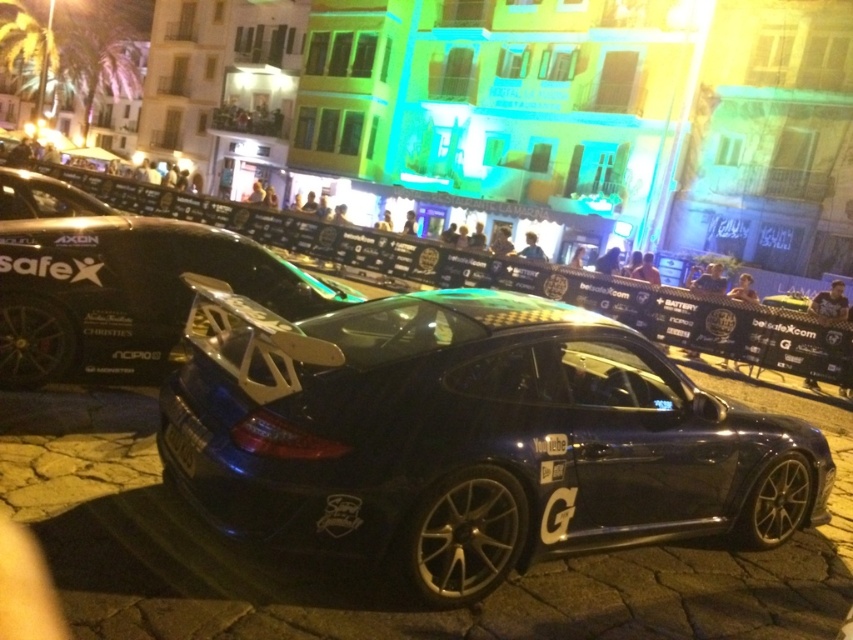
Based on the photo, who is taller, glossy carbon fiber sports car at center or glossy carbon fiber car at center?

Standing taller between the two is glossy carbon fiber sports car at center.

Is point (426, 380) positioned in front of point (70, 243)?

Yes.

This screenshot has width=853, height=640. Identify the location of glossy carbon fiber sports car at center. (467, 436).